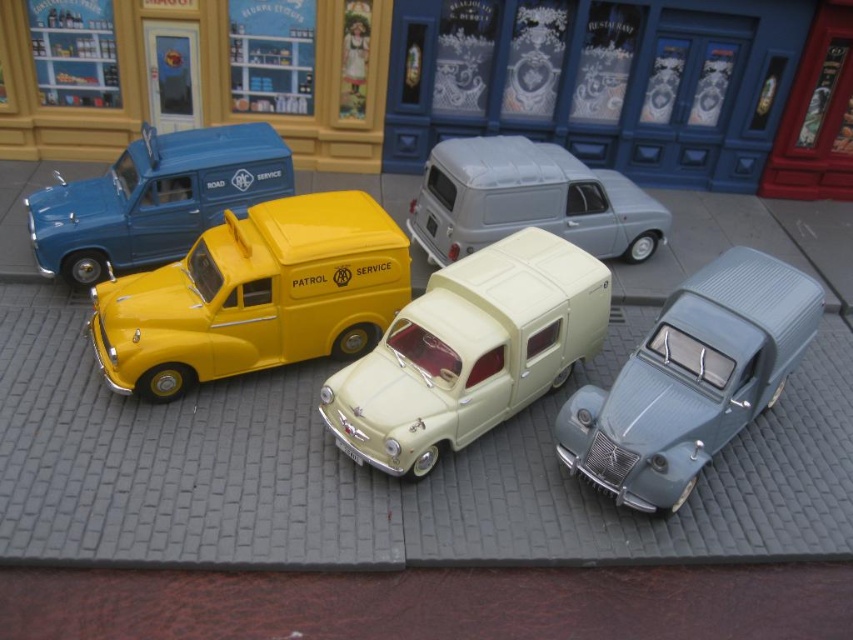
Is yellow matte van at center positioned behind metallic blue car at lower right?

Yes.

Who is more forward, (x=210, y=280) or (x=656, y=449)?

Point (x=656, y=449)

At what (x,y) coordinates should I click in order to perform the action: click on yellow matte van at center. Please return your answer as a coordinate pair (x, y). Image resolution: width=853 pixels, height=640 pixels. Looking at the image, I should click on (254, 296).

Is matte blue van at left thinner than matte gray van at center?

Correct, matte blue van at left's width is less than matte gray van at center's.

Is matte blue van at left further to the viewer compared to matte gray van at center?

No, matte blue van at left is in front of matte gray van at center.

Who is more distant from viewer, (160, 216) or (669, 225)?

Point (669, 225)

Identify the location of matte blue van at left. (154, 198).

Between matte cream van at center and matte gray van at center, which one has less height?

With less height is matte gray van at center.

How far apart are matte cream van at center and matte gray van at center?

matte cream van at center is 1.59 meters from matte gray van at center.

Is point (581, 259) positioned behind point (498, 152)?

No, it is in front of (498, 152).

Find the location of `matte cream van at center`. matte cream van at center is located at coordinates tap(469, 352).